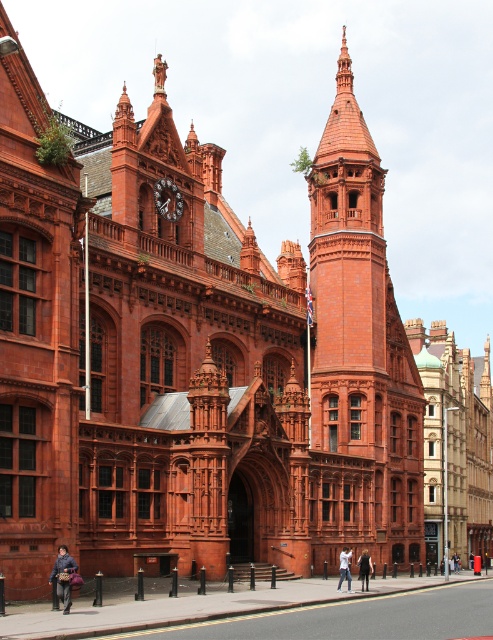
You are a visitor standing in front of the grand historic building. You notice the metallic clock face at upper center and the dark gray fabric coat at center. Which object appears narrower in the image?

The metallic clock face at upper center is thinner than the dark gray fabric coat at center, so the metallic clock face at upper center appears narrower.

You are a visitor standing at the entrance of the historic building. You notice the metallic clock face at upper center and the dark gray fabric coat at center. Which object takes up more space in the image?

The dark gray fabric coat at center takes up more space in the image than the metallic clock face at upper center, as the metallic clock face at upper center occupies less space than dark gray fabric coat at center.

You are a visitor standing in front of the historic building. You see the metallic clock face at upper center and the dark gray fabric coat at center. Which object is closer to you?

The metallic clock face at upper center is closer to you because the dark gray fabric coat at center is behind it.